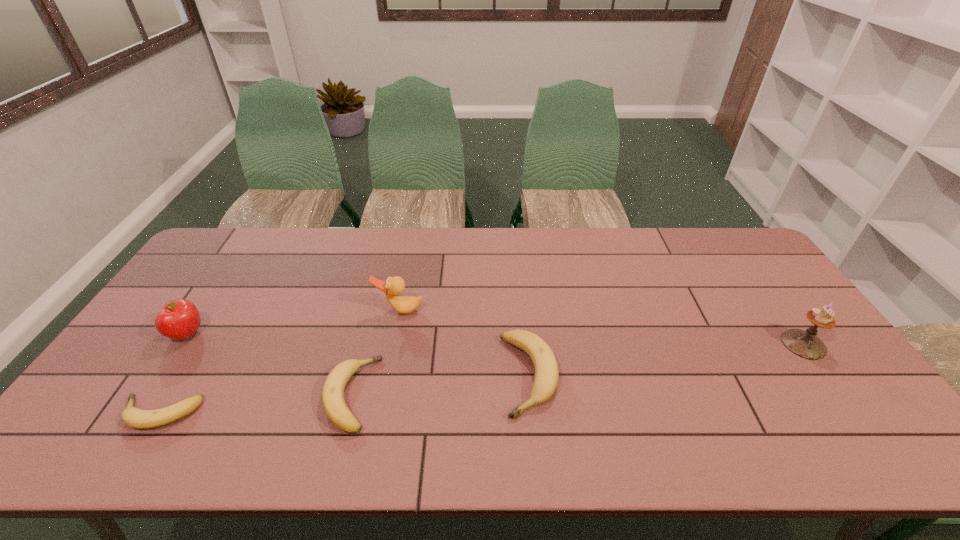
Locate an element on the screen. The image size is (960, 540). the shortest object is located at coordinates (134, 417).

Image resolution: width=960 pixels, height=540 pixels. I want to click on the shortest banana, so click(134, 417).

At what (x,y) coordinates should I click in order to perform the action: click on the second shortest banana. Please return your answer as a coordinate pair (x, y). The image size is (960, 540). Looking at the image, I should click on (333, 401).

The height and width of the screenshot is (540, 960). Identify the location of the second banana from right to left. (333, 401).

Locate an element on the screen. The width and height of the screenshot is (960, 540). the fifth object from left to right is located at coordinates (545, 382).

Locate an element on the screen. Image resolution: width=960 pixels, height=540 pixels. apple is located at coordinates (179, 319).

Where is `candle holder`? The height and width of the screenshot is (540, 960). candle holder is located at coordinates (805, 344).

The image size is (960, 540). I want to click on the rightmost object, so click(805, 344).

This screenshot has height=540, width=960. In order to click on duck in this screenshot , I will do `click(393, 286)`.

Locate an element on the screen. blank area located on the back of the leftmost banana is located at coordinates (210, 330).